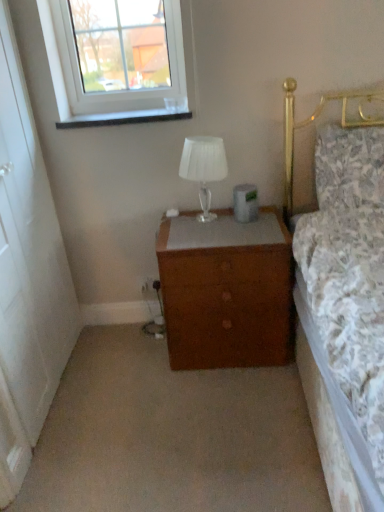
Question: Considering the relative sizes of clear glass window at upper left and translucent glass lamp at center in the image provided, is clear glass window at upper left smaller than translucent glass lamp at center?

Choices:
 (A) no
 (B) yes

Answer: (A)

Question: Is clear glass window at upper left with translucent glass lamp at center?

Choices:
 (A) yes
 (B) no

Answer: (B)

Question: Considering the relative sizes of clear glass window at upper left and translucent glass lamp at center in the image provided, is clear glass window at upper left bigger than translucent glass lamp at center?

Choices:
 (A) no
 (B) yes

Answer: (B)

Question: Does clear glass window at upper left appear on the left side of translucent glass lamp at center?

Choices:
 (A) no
 (B) yes

Answer: (B)

Question: Is clear glass window at upper left to the right of translucent glass lamp at center from the viewer's perspective?

Choices:
 (A) yes
 (B) no

Answer: (B)

Question: From their relative heights in the image, would you say floral fabric pillow at upper right is taller or shorter than translucent glass lamp at center?

Choices:
 (A) short
 (B) tall

Answer: (B)

Question: Is floral fabric pillow at upper right inside or outside of translucent glass lamp at center?

Choices:
 (A) outside
 (B) inside

Answer: (A)

Question: In the image, is floral fabric pillow at upper right positioned in front of or behind translucent glass lamp at center?

Choices:
 (A) front
 (B) behind

Answer: (A)

Question: From a real-world perspective, is floral fabric pillow at upper right physically located above or below translucent glass lamp at center?

Choices:
 (A) below
 (B) above

Answer: (B)

Question: Does point (152, 349) appear closer or farther from the camera than point (332, 184)?

Choices:
 (A) closer
 (B) farther

Answer: (B)

Question: In the image, is brown wooden chest of drawers at center positioned in front of or behind floral fabric pillow at upper right?

Choices:
 (A) front
 (B) behind

Answer: (A)

Question: From the image's perspective, relative to floral fabric pillow at upper right, is brown wooden chest of drawers at center above or below?

Choices:
 (A) below
 (B) above

Answer: (A)

Question: In terms of height, does brown wooden chest of drawers at center look taller or shorter compared to floral fabric pillow at upper right?

Choices:
 (A) tall
 (B) short

Answer: (B)

Question: Does point (281, 355) appear closer or farther from the camera than point (329, 190)?

Choices:
 (A) closer
 (B) farther

Answer: (B)

Question: In the image, is brown wooden chest of drawers at center on the left side or the right side of floral fabric pillow at upper right?

Choices:
 (A) left
 (B) right

Answer: (A)